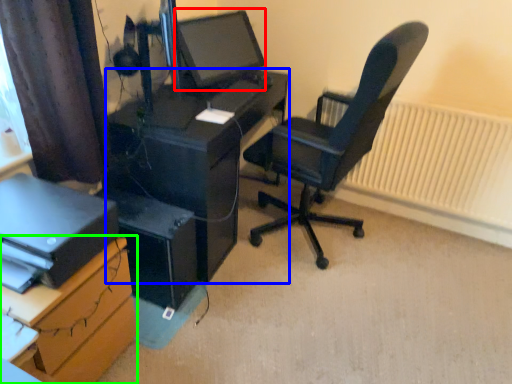
Question: Which object is positioned closest to computer monitor (highlighted by a red box)? Select from desk (highlighted by a blue box) and desk (highlighted by a green box).

Choices:
 (A) desk
 (B) desk

Answer: (A)